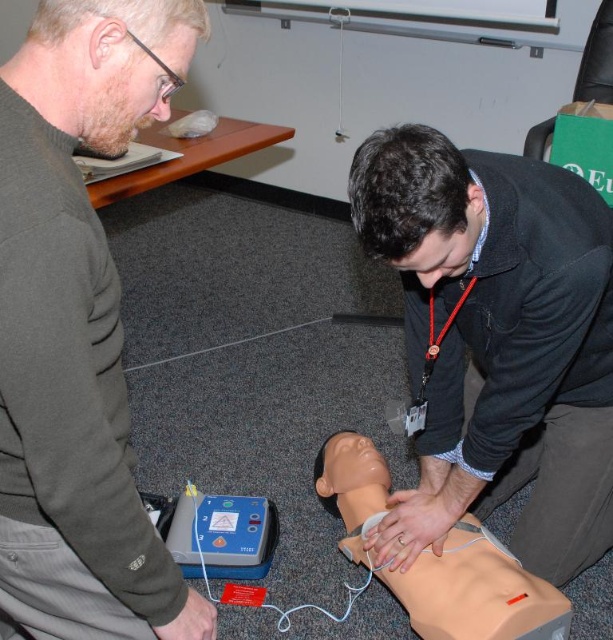
Does matte black jacket at lower center have a greater height compared to beige rubber mannequin torso at center?

Yes.

Who is shorter, matte black jacket at lower center or beige rubber mannequin torso at center?

beige rubber mannequin torso at center is shorter.

The height and width of the screenshot is (640, 613). What are the coordinates of `matte black jacket at lower center` in the screenshot? It's located at (497, 342).

Image resolution: width=613 pixels, height=640 pixels. In order to click on matte black jacket at lower center in this screenshot , I will do `click(497, 342)`.

Does beige rubber mannequin torso at center have a lesser width compared to gray plastic defibrillator at lower center?

Incorrect, beige rubber mannequin torso at center's width is not less than gray plastic defibrillator at lower center's.

Image resolution: width=613 pixels, height=640 pixels. In order to click on beige rubber mannequin torso at center in this screenshot , I will do `click(476, 592)`.

Is point (371, 481) more distant than point (210, 532)?

No, it is in front of (210, 532).

I want to click on beige rubber mannequin torso at center, so click(x=476, y=592).

Which is behind, point (413, 550) or point (196, 566)?

Positioned behind is point (196, 566).

Does point (498, 269) lie behind point (253, 576)?

No, it is in front of (253, 576).

This screenshot has height=640, width=613. I want to click on matte black jacket at lower center, so click(497, 342).